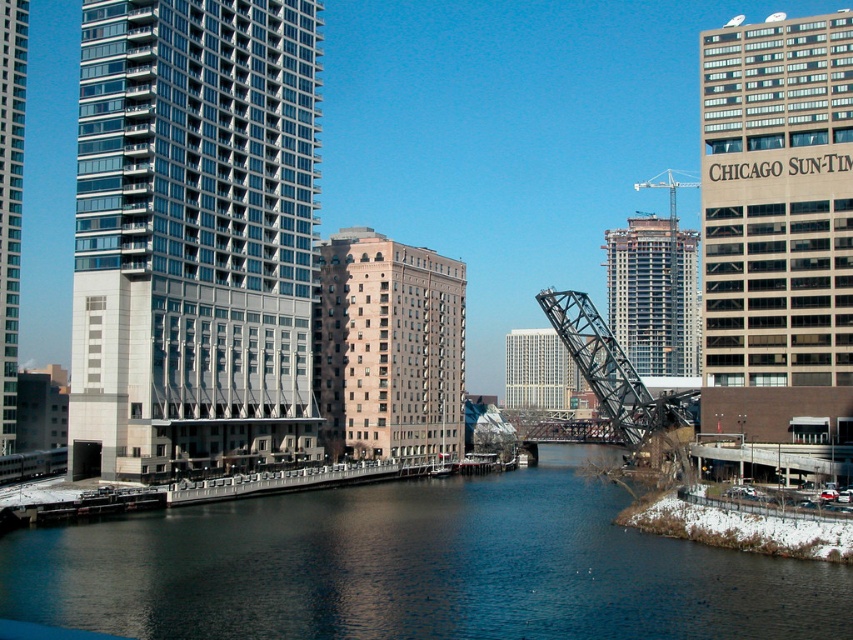
Is glassy concrete skyscraper at left in front of white glass building at center?

Yes, it is in front of white glass building at center.

Which is above, glassy concrete skyscraper at left or white glass building at center?

Positioned higher is glassy concrete skyscraper at left.

Does point (210, 426) come farther from viewer compared to point (576, 369)?

No, (210, 426) is in front of (576, 369).

Where is `glassy concrete skyscraper at left`? The image size is (853, 640). glassy concrete skyscraper at left is located at coordinates (193, 236).

Between dark blue water at center and white glass building at center, which one has more height?

white glass building at center

Can you confirm if dark blue water at center is positioned above white glass building at center?

No.

Between point (651, 624) and point (550, 326), which one is positioned in front?

Point (651, 624)

Find the location of a particular element. Image resolution: width=853 pixels, height=640 pixels. dark blue water at center is located at coordinates (415, 566).

Does glassy concrete skyscraper at left have a lesser height compared to brown brick building at center?

No.

Does glassy concrete skyscraper at left lie behind brown brick building at center?

That is False.

Who is more forward, (194, 193) or (328, 429)?

Point (194, 193) is more forward.

Where is `glassy concrete skyscraper at left`? glassy concrete skyscraper at left is located at coordinates (193, 236).